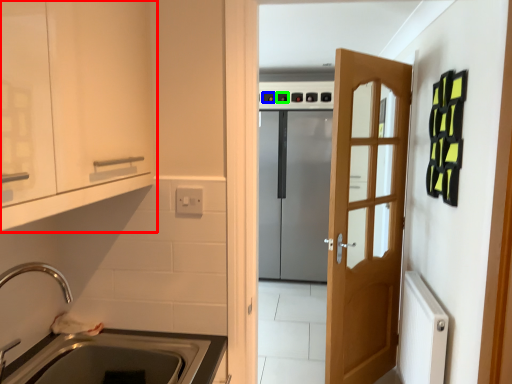
Question: Based on their relative distances, which object is nearer to cabinetry (highlighted by a red box)? Choose from knob (highlighted by a blue box) and knob (highlighted by a green box).

Choices:
 (A) knob
 (B) knob

Answer: (B)